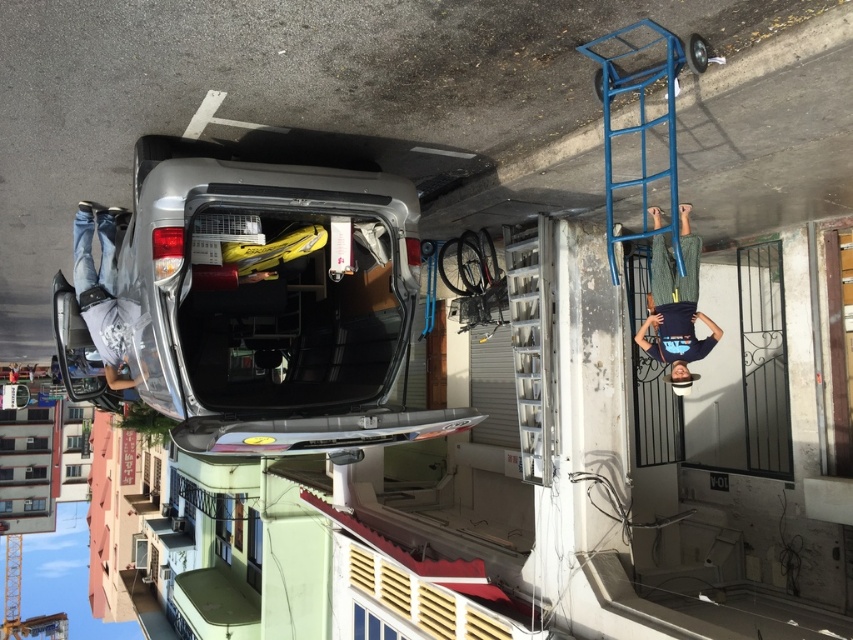
Question: Is dark green knitted sweater at upper right above jeans at left?

Choices:
 (A) no
 (B) yes

Answer: (B)

Question: Can you confirm if satin silver car at center is positioned to the right of dark green knitted sweater at upper right?

Choices:
 (A) yes
 (B) no

Answer: (B)

Question: Which object is the closest to the dark green knitted sweater at upper right?

Choices:
 (A) satin silver car at center
 (B) jeans at left

Answer: (A)

Question: Which object appears farthest from the camera in this image?

Choices:
 (A) satin silver car at center
 (B) dark green knitted sweater at upper right
 (C) jeans at left

Answer: (B)

Question: Which object is farther from the camera taking this photo?

Choices:
 (A) dark green knitted sweater at upper right
 (B) satin silver car at center
 (C) jeans at left

Answer: (A)

Question: Is satin silver car at center closer to camera compared to jeans at left?

Choices:
 (A) no
 (B) yes

Answer: (B)